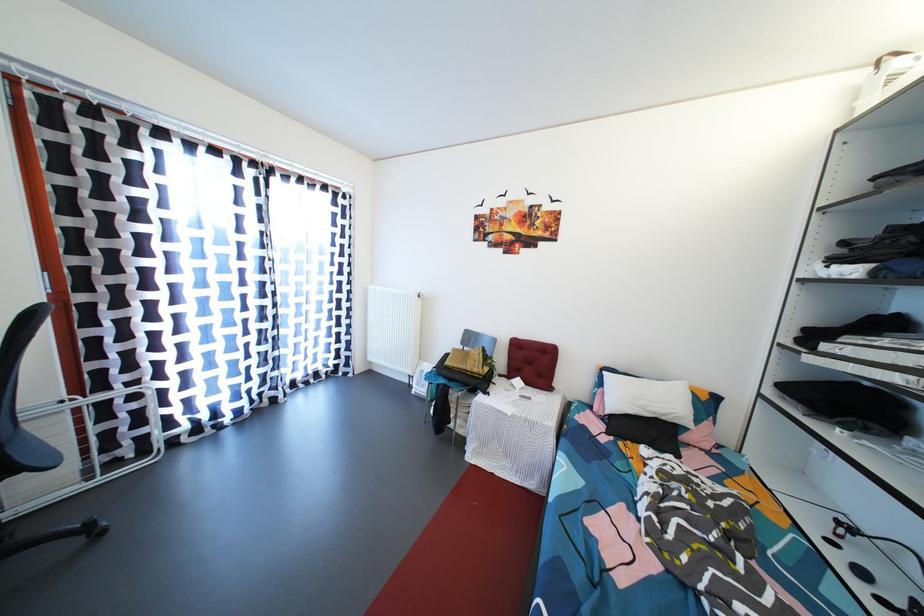
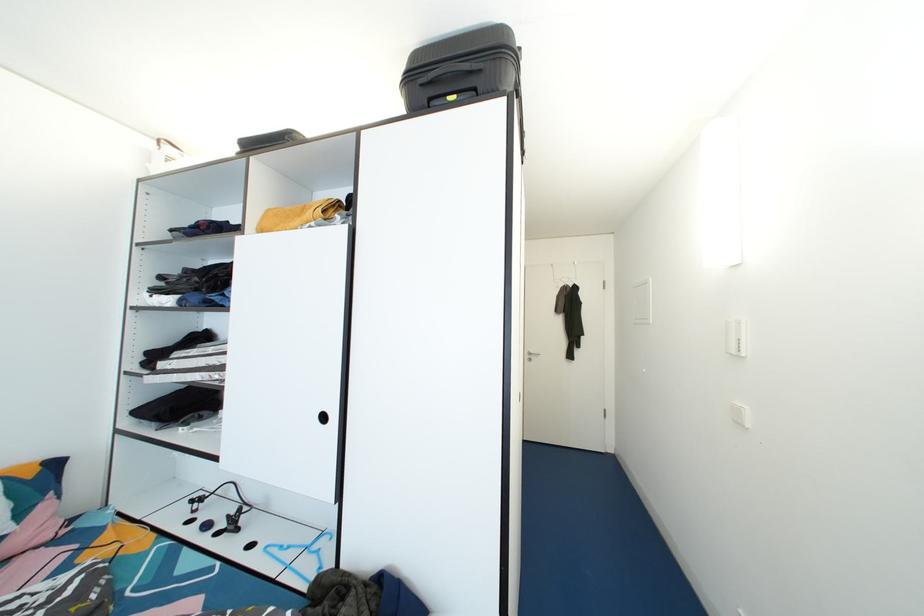
Question: How did the camera likely rotate?

Choices:
 (A) Left
 (B) Right
 (C) Up
 (D) Down

Answer: (B)